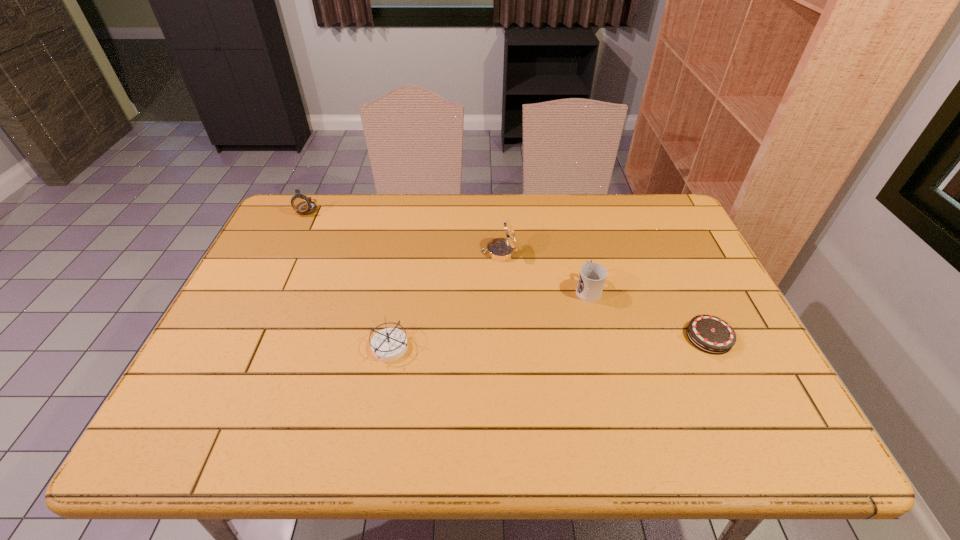
Locate an element on the screen. vacant space that satisfies the following two spatial constraints: 1. with the dial facing the second nearest compass; 2. on the handle side of the third shortest object is located at coordinates (501, 289).

Where is `free spot that satisfies the following two spatial constraints: 1. with the dial facing the second farthest compass; 2. on the left side of the shortest object`? The image size is (960, 540). free spot that satisfies the following two spatial constraints: 1. with the dial facing the second farthest compass; 2. on the left side of the shortest object is located at coordinates (503, 337).